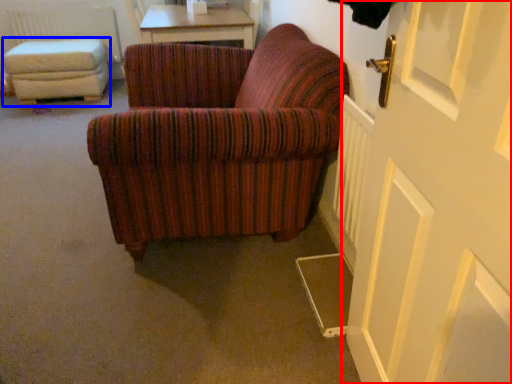
Question: Among these objects, which one is farthest to the camera, door (highlighted by a red box) or stool (highlighted by a blue box)?

Choices:
 (A) door
 (B) stool

Answer: (B)